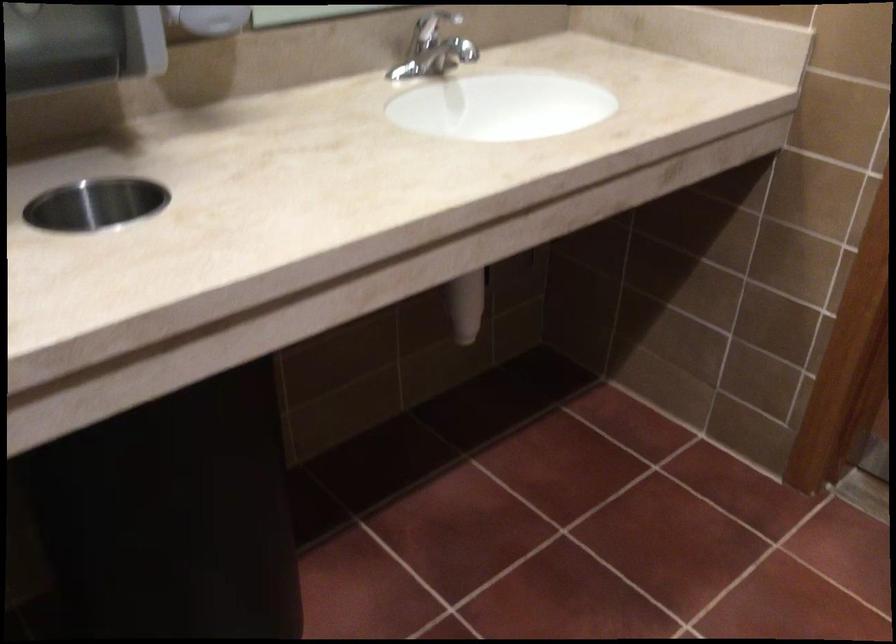
The first image is from the beginning of the video and the second image is from the end. How did the camera likely rotate when shooting the video?

The camera rotated toward right-down.